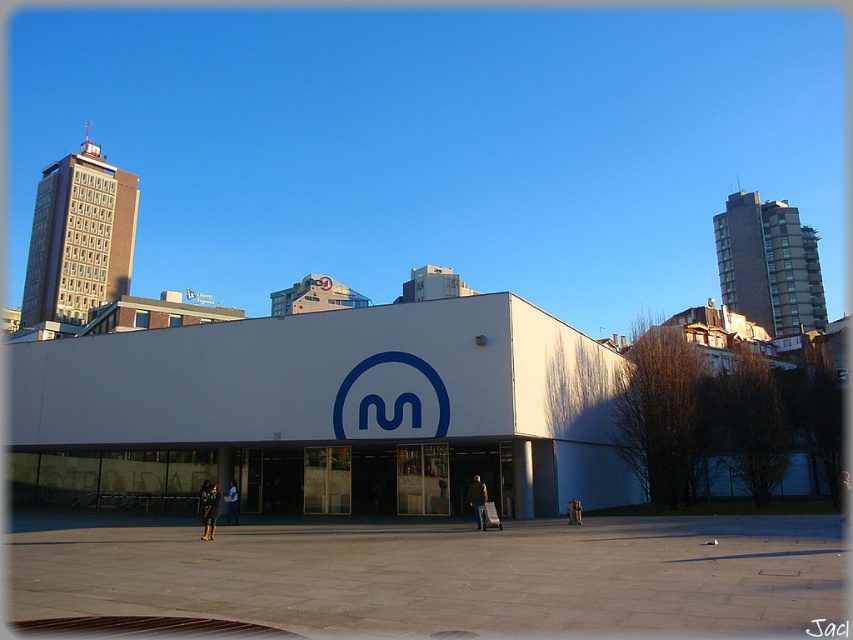
Question: Does white smooth building at center appear on the left side of light brown leather jacket at center?

Choices:
 (A) no
 (B) yes

Answer: (B)

Question: Which of the following is the farthest from the observer?

Choices:
 (A) light brown leather jacket at center
 (B) dark blue leather jacket at center

Answer: (A)

Question: Among these points, which one is nearest to the camera?

Choices:
 (A) (212, 484)
 (B) (477, 490)
 (C) (453, 394)

Answer: (B)

Question: Estimate the real-world distances between objects in this image. Which object is closer to the white smooth building at center?

Choices:
 (A) dark blue leather jacket at center
 (B) dark green fabric jacket at center

Answer: (A)

Question: Can you confirm if light brown leather jacket at center is positioned to the right of dark green fabric jacket at center?

Choices:
 (A) yes
 (B) no

Answer: (A)

Question: From the image, what is the correct spatial relationship of light brown leather jacket at center in relation to dark green fabric jacket at center?

Choices:
 (A) right
 (B) left

Answer: (A)